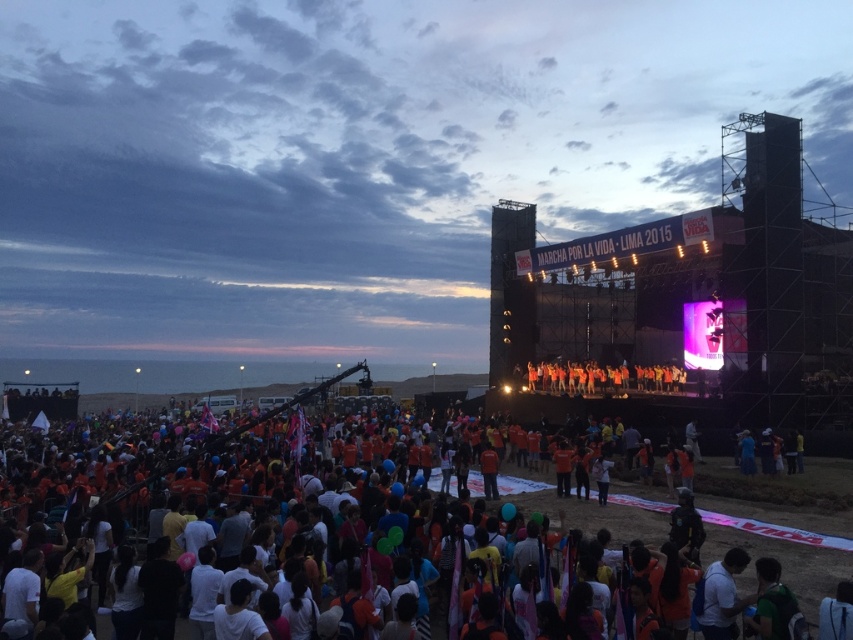
Is orange t-shirts at lower center smaller than orange fabric people at center?

No.

Who is more forward, (785, 620) or (657, 378)?

Point (785, 620)

The width and height of the screenshot is (853, 640). I want to click on orange t-shirts at lower center, so click(404, 536).